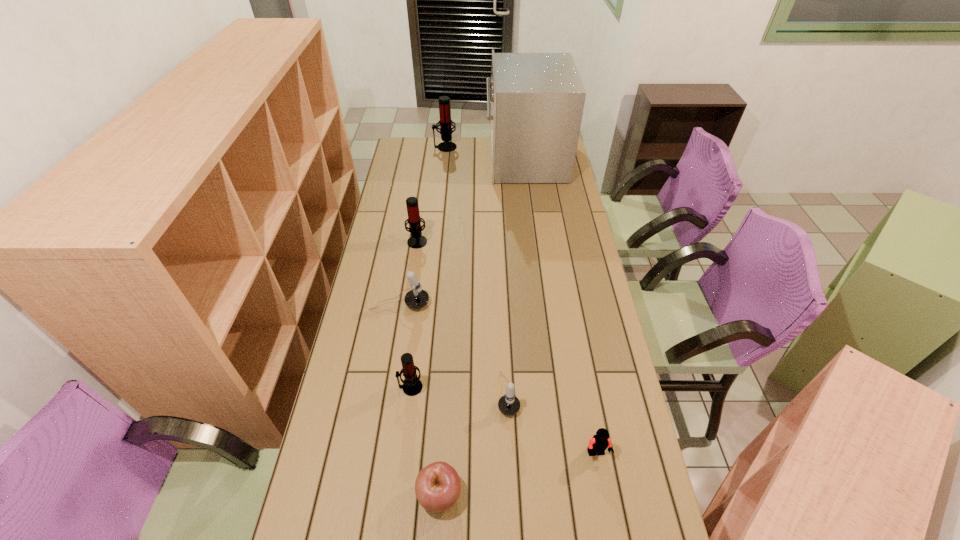
At what (x,y) coordinates should I click in order to perform the action: click on free space at the right edge of the desktop. Please return your answer as a coordinate pair (x, y). Looking at the image, I should click on (585, 293).

Image resolution: width=960 pixels, height=540 pixels. In the image, there is a desktop. In order to click on vacant space at the far left corner in this screenshot , I will do `click(403, 147)`.

Where is `blank region between the farthest red microphone and the smallest red microphone`? The image size is (960, 540). blank region between the farthest red microphone and the smallest red microphone is located at coordinates (428, 267).

Identify the location of vacant space that's between the smallest red microphone and the toaster oven. (468, 273).

The width and height of the screenshot is (960, 540). I want to click on empty space that is in between the left white microphone and the right white microphone, so click(454, 349).

Where is `free space between the shortest object and the shortest microphone`? free space between the shortest object and the shortest microphone is located at coordinates (474, 444).

Where is `vacant space that's between the farthest microphone and the second nearest object`? Image resolution: width=960 pixels, height=540 pixels. vacant space that's between the farthest microphone and the second nearest object is located at coordinates (521, 300).

Identify the location of vacant region between the toaster oven and the tallest microphone. Image resolution: width=960 pixels, height=540 pixels. (485, 153).

You are a GUI agent. You are given a task and a screenshot of the screen. Output one action in this format:
    pyautogui.click(x=<x>, y=<y>)
    Task: Click on the unoccupied area between the sixth nearest object and the nearer white microphone
    Image resolution: width=960 pixels, height=540 pixels.
    Given the screenshot: What is the action you would take?
    pyautogui.click(x=463, y=317)

Where is `free space between the right white microphone and the biggest red microphone`? The height and width of the screenshot is (540, 960). free space between the right white microphone and the biggest red microphone is located at coordinates (476, 271).